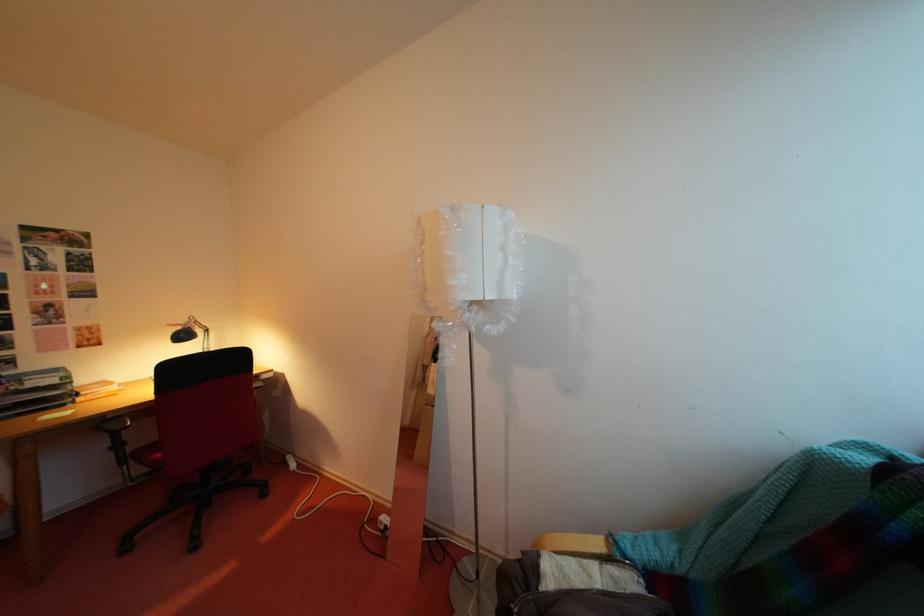
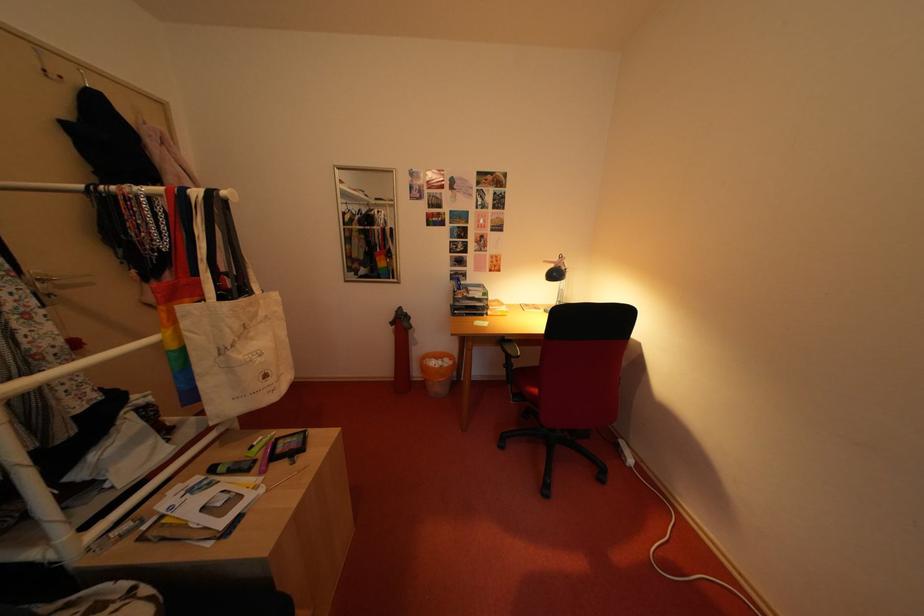
In the second image, find the point that corresponds to pixel 189 333 in the first image.

(563, 270)